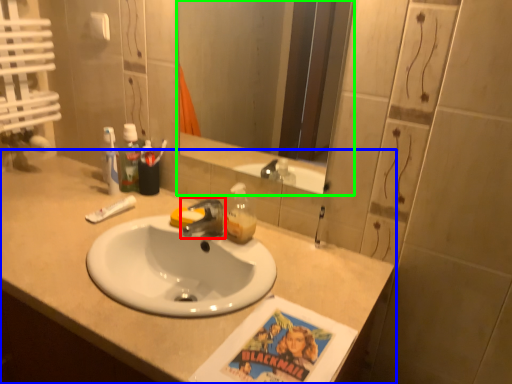
Question: Which object is the farthest from tap (highlighted by a red box)? Choose among these: countertop (highlighted by a blue box) or mirror (highlighted by a green box).

Choices:
 (A) countertop
 (B) mirror

Answer: (B)